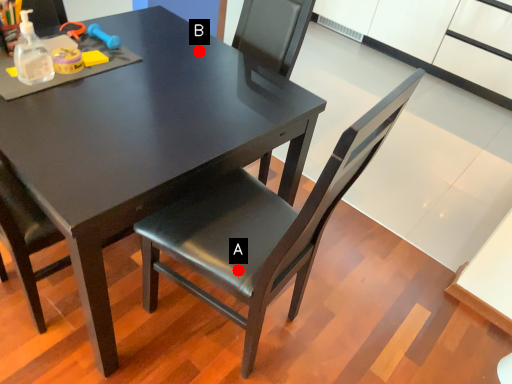
Question: Two points are circled on the image, labeled by A and B beside each circle. Which point is closer to the camera?

Choices:
 (A) A is closer
 (B) B is closer

Answer: (A)